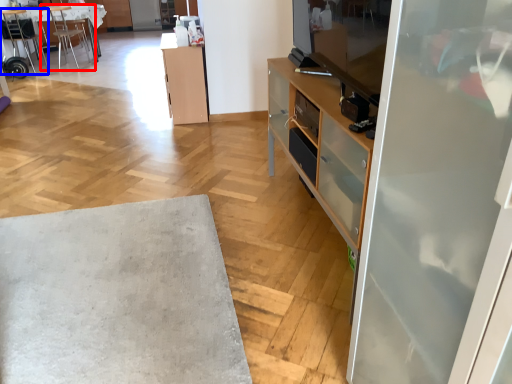
Question: Which point is further to the camera, chair (highlighted by a red box) or chair (highlighted by a blue box)?

Choices:
 (A) chair
 (B) chair

Answer: (A)